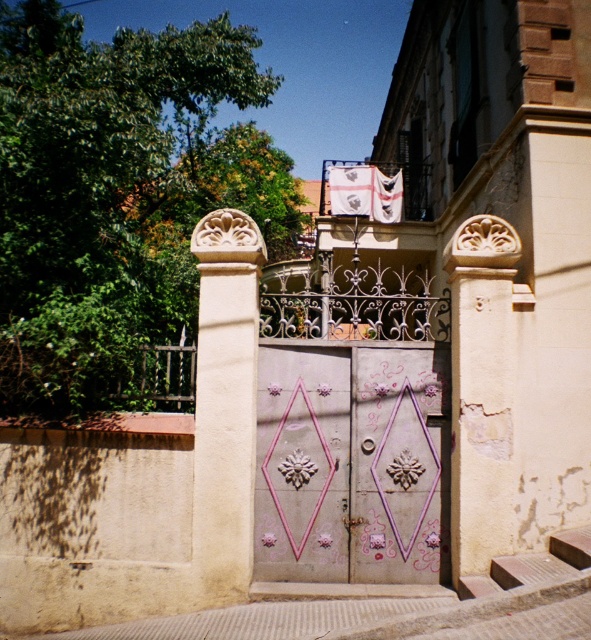
Question: Is pink painted wood door at center thinner than white stone column at center?

Choices:
 (A) yes
 (B) no

Answer: (B)

Question: Observing the image, what is the correct spatial positioning of pink painted wood door at center in reference to white stone column at center?

Choices:
 (A) above
 (B) below

Answer: (B)

Question: Does pink painted wood door at center appear under white stone column at center?

Choices:
 (A) yes
 (B) no

Answer: (A)